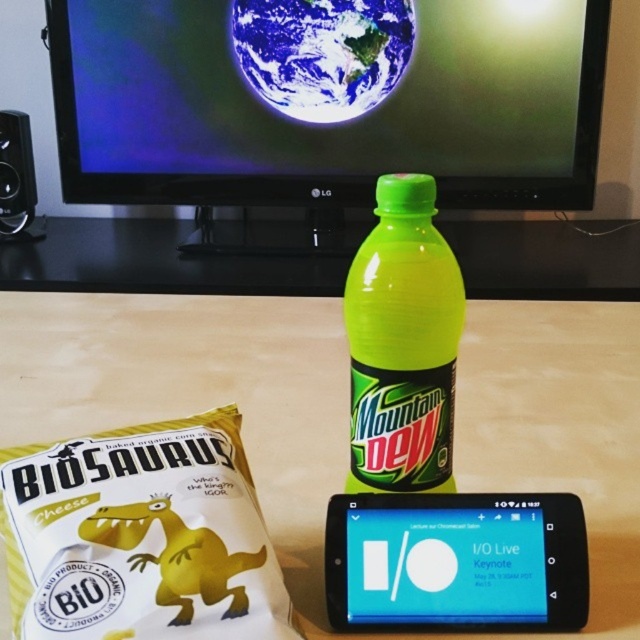
Does matte black monitor at upper center have a lesser height compared to matte plastic table at center?

No.

This screenshot has width=640, height=640. Describe the element at coordinates (326, 100) in the screenshot. I see `matte black monitor at upper center` at that location.

Where is `matte black monitor at upper center`? matte black monitor at upper center is located at coordinates (326, 100).

Does matte plastic table at center appear over black plastic speaker at left?

No, matte plastic table at center is not above black plastic speaker at left.

Which is more to the right, matte plastic table at center or black plastic speaker at left?

matte plastic table at center is more to the right.

Is point (481, 380) positioned after point (10, 182)?

No, (481, 380) is in front of (10, 182).

Image resolution: width=640 pixels, height=640 pixels. Find the location of `matte plastic table at center`. matte plastic table at center is located at coordinates pos(196,396).

Which is in front, point (300, 145) or point (424, 579)?

Point (424, 579)

Can you confirm if matte black monitor at upper center is thinner than blue glossy smartphone at center?

No.

Image resolution: width=640 pixels, height=640 pixels. What do you see at coordinates (326, 100) in the screenshot?
I see `matte black monitor at upper center` at bounding box center [326, 100].

The height and width of the screenshot is (640, 640). I want to click on matte black monitor at upper center, so click(326, 100).